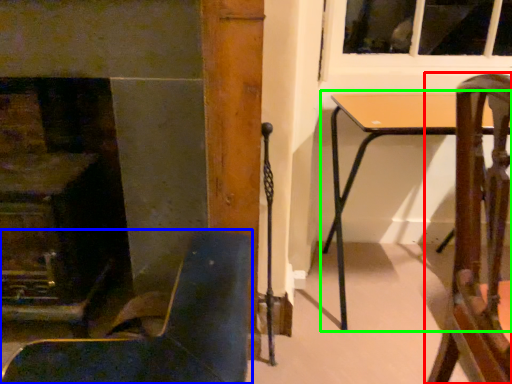
Question: Which is farther away from chair (highlighted by a red box)? chair (highlighted by a blue box) or table (highlighted by a green box)?

Choices:
 (A) chair
 (B) table

Answer: (B)